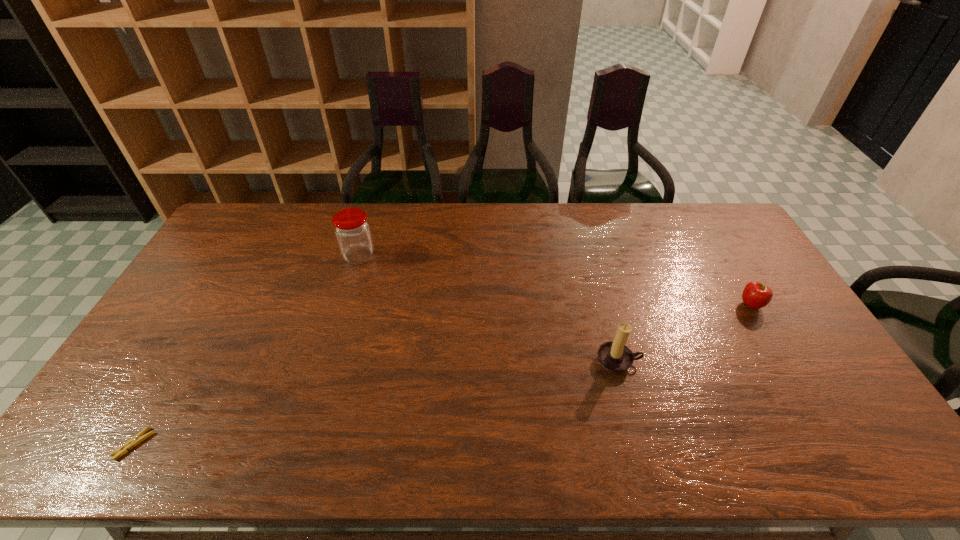
You are a GUI agent. You are given a task and a screenshot of the screen. Output one action in this format:
    pyautogui.click(x=<x>, y=<y>)
    Task: Click on the object that is the second closest to the clothespin
    
    Given the screenshot: What is the action you would take?
    pyautogui.click(x=614, y=356)

Identify which object is located as the second nearest to the apple. Please provide its 2D coordinates. Your answer should be formatted as a tuple, i.e. [(x, y)], where the tuple contains the x and y coordinates of a point satisfying the conditions above.

[(352, 230)]

What are the coordinates of `free space in the image that satisfies the following two spatial constraints: 1. on the back side of the apple; 2. on the right side of the shortest object` in the screenshot? It's located at (215, 305).